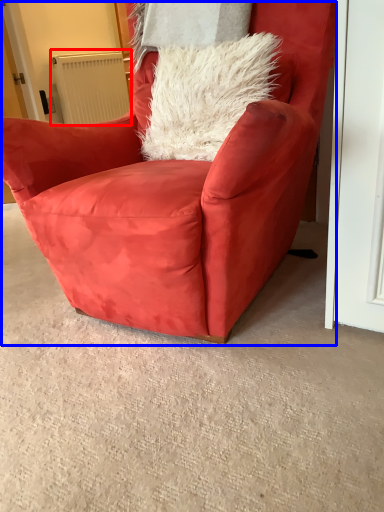
Question: Which of the following is the closest to the observer, radiator (highlighted by a red box) or chair (highlighted by a blue box)?

Choices:
 (A) radiator
 (B) chair

Answer: (B)